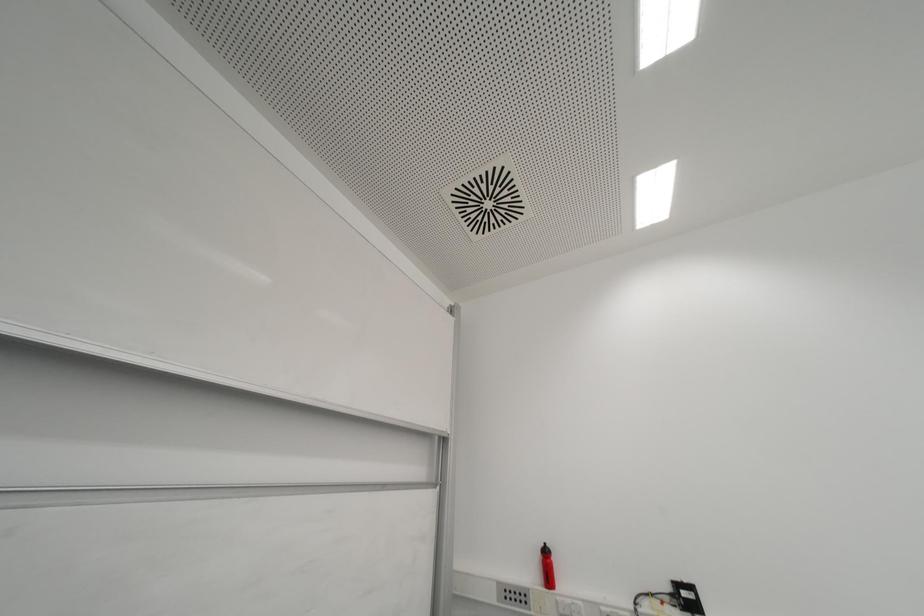
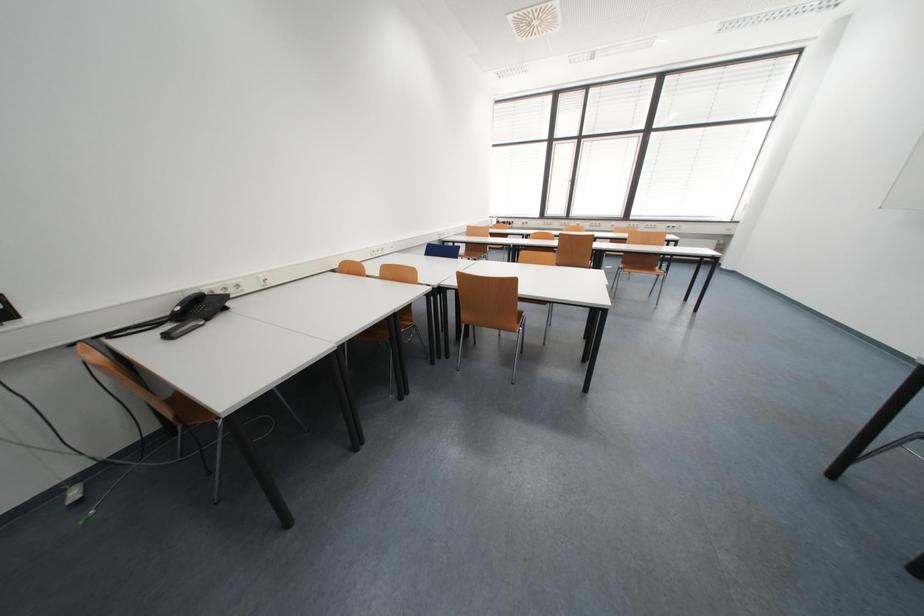
Based on the continuous images, in which direction is the camera rotating?

The camera rotated toward right-down.